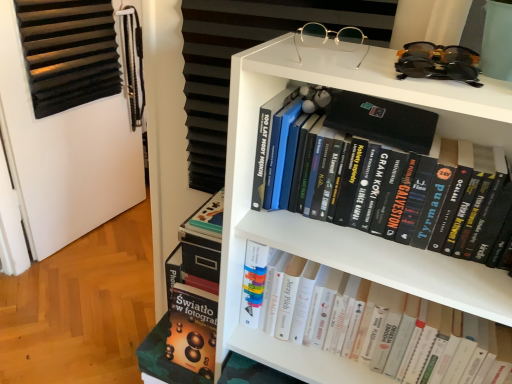
Question: Is black matte book at upper center, the first book positioned from the top, taller or shorter than black plastic sunglasses at upper right, marked as the 1th glasses in a right-to-left arrangement?

Choices:
 (A) tall
 (B) short

Answer: (A)

Question: Is black matte book at upper center, the first book positioned from the top, wider or thinner than black plastic sunglasses at upper right, the 2th glasses when ordered from left to right?

Choices:
 (A) thin
 (B) wide

Answer: (B)

Question: Which object is positioned closest to the white matte bookcase at upper center?

Choices:
 (A) gold metallic glasses at upper center, marked as the 1th glasses in a left-to-right arrangement
 (B) black matte book at upper center, the 2th book from the bottom
 (C) hardcover books at center, which is the first book from bottom to top
 (D) black plastic sunglasses at upper right, marked as the 1th glasses in a right-to-left arrangement

Answer: (B)

Question: Which is nearer to the black matte book at upper center, the 2th book from the bottom?

Choices:
 (A) black plastic sunglasses at upper right, marked as the 1th glasses in a right-to-left arrangement
 (B) white matte bookcase at upper center
 (C) gold metallic glasses at upper center, marked as the 1th glasses in a left-to-right arrangement
 (D) hardcover books at center, which is the 2th book from top to bottom

Answer: (B)